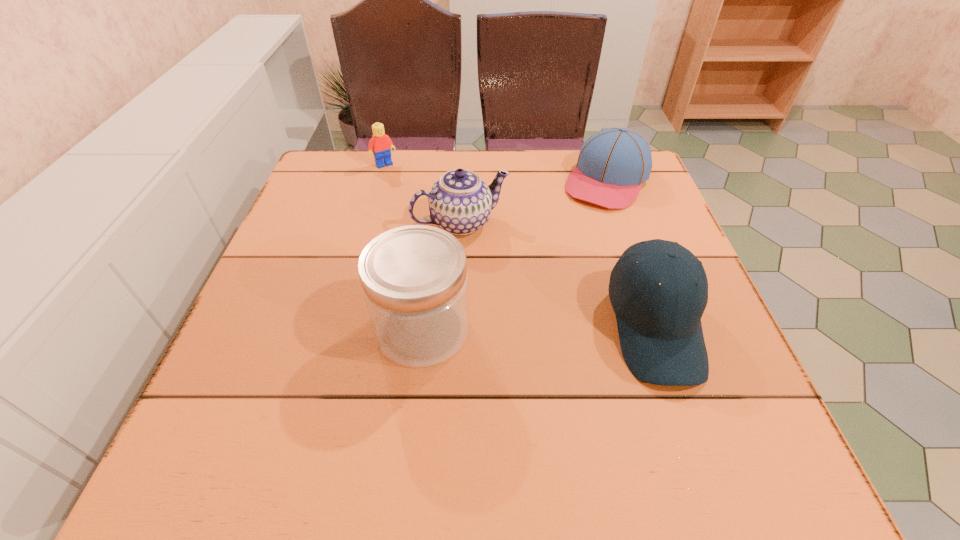
At what (x,y) coordinates should I click in order to perform the action: click on free space on the desktop that is between the jar and the taller baseball cap and is positioned on the face of the Lego. Please return your answer as a coordinate pair (x, y). The height and width of the screenshot is (540, 960). Looking at the image, I should click on (505, 329).

The width and height of the screenshot is (960, 540). Identify the location of vacant spot on the desktop that is between the jar and the nearer baseball cap and is positioned at the spout of the chinaware. (526, 329).

In order to click on vacant spot on the desktop that is between the jar and the nearer baseball cap and is positioned on the front-facing side of the farther baseball cap in this screenshot , I will do `click(512, 329)`.